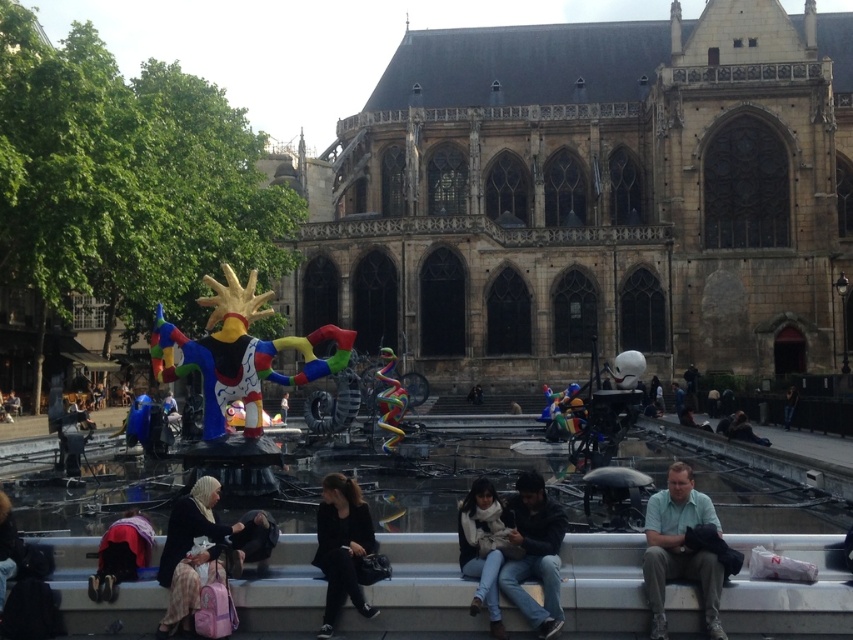
Looking at this image, you are standing in front of the Gothic building and see two points marked in the image. Which of the two points, point (457, 522) or point (125, 573), is closer to you?

Point (457, 522) is further to the camera than point (125, 573), so the closer point to you is point (125, 573).

You are a photographer aiming to capture both the plaid skirt at lower left and the dark blue fabric at lower left in the same frame. Since you want to ensure both are fully visible, which object should you focus on to frame the wider one first?

The plaid skirt at lower left is wider than the dark blue fabric at lower left, so you should focus on framing the plaid skirt at lower left first to accommodate its wider size.

You are a photographer trying to capture both the dark blue jeans at center and the plaid skirt at lower left in a single shot. Based on their positions, which object should you focus on first to ensure both are in frame?

Since the dark blue jeans at center is to the right of the plaid skirt at lower left, you should focus on the plaid skirt at lower left first to ensure both are included in the frame.